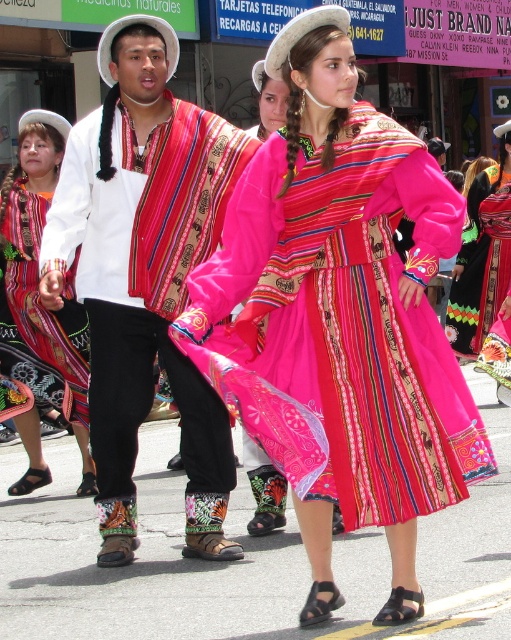
Question: Does velvet pink dress at center appear over matte black dress at center?

Choices:
 (A) yes
 (B) no

Answer: (B)

Question: Which point is farther to the camera?

Choices:
 (A) velvet pink dress at center
 (B) matte white shirt at center
 (C) matte black dress at center

Answer: (C)

Question: Which point appears closest to the camera in this image?

Choices:
 (A) (364, 458)
 (B) (71, 324)

Answer: (A)

Question: Is the position of matte white shirt at center more distant than that of matte black dress at center?

Choices:
 (A) yes
 (B) no

Answer: (B)

Question: Among these points, which one is farthest from the camera?

Choices:
 (A) (6, 289)
 (B) (359, 170)

Answer: (A)

Question: Does velvet pink dress at center appear on the right side of matte white shirt at center?

Choices:
 (A) yes
 (B) no

Answer: (A)